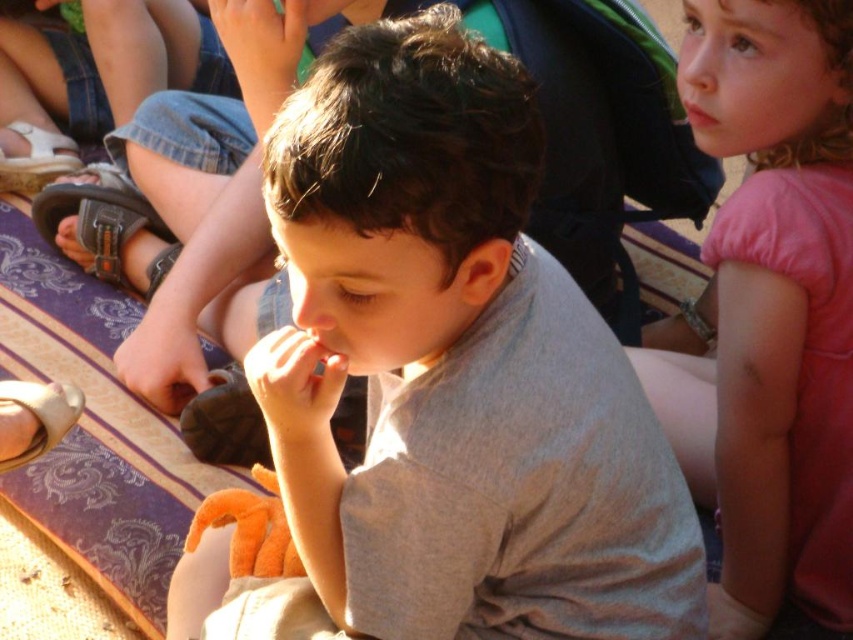
Does gray cotton shirt at center appear over brown leather sandal at lower left?

No, gray cotton shirt at center is not above brown leather sandal at lower left.

Is point (395, 65) positioned before point (76, 168)?

Yes, point (395, 65) is in front of point (76, 168).

At what (x,y) coordinates should I click in order to perform the action: click on gray cotton shirt at center. Please return your answer as a coordinate pair (x, y). The image size is (853, 640). Looking at the image, I should click on (454, 368).

Who is more forward, (41, 150) or (32, 412)?

Positioned in front is point (32, 412).

Identify the location of brown leather sandal at lower left. This screenshot has height=640, width=853. (35, 157).

Between point (68, 172) and point (61, 412), which one is positioned in front?

Point (61, 412)

What are the coordinates of `brown leather sandal at lower left` in the screenshot? It's located at (35, 157).

Locate an element on the screen. This screenshot has width=853, height=640. gray cotton shirt at center is located at coordinates (454, 368).

Where is `gray cotton shirt at center`? This screenshot has width=853, height=640. gray cotton shirt at center is located at coordinates (454, 368).